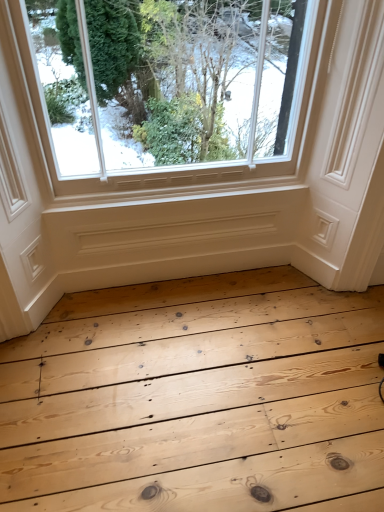
What do you see at coordinates (167, 89) in the screenshot?
I see `clear glass window at upper center` at bounding box center [167, 89].

Locate an element on the screen. clear glass window at upper center is located at coordinates (167, 89).

This screenshot has height=512, width=384. I want to click on clear glass window at upper center, so click(x=167, y=89).